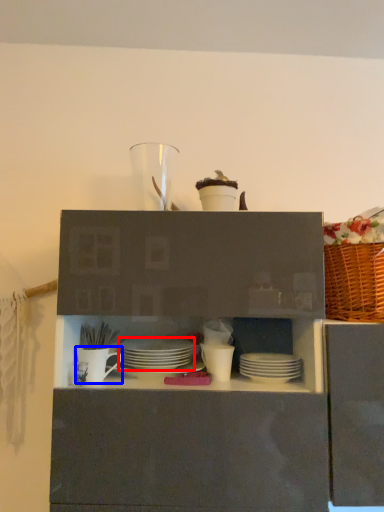
Question: Among these objects, which one is farthest to the camera, tableware (highlighted by a red box) or tableware (highlighted by a blue box)?

Choices:
 (A) tableware
 (B) tableware

Answer: (A)